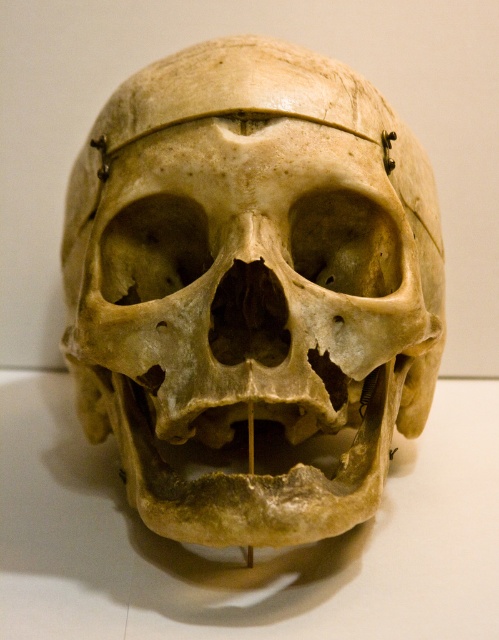
Question: Is bone-like skull at center to the right of yellowish bone at center from the viewer's perspective?

Choices:
 (A) no
 (B) yes

Answer: (B)

Question: Is bone-like skull at center bigger than yellowish bone at center?

Choices:
 (A) yes
 (B) no

Answer: (B)

Question: Among these points, which one is nearest to the camera?

Choices:
 (A) (24, 531)
 (B) (180, 314)

Answer: (B)

Question: Which point is closer to the camera?

Choices:
 (A) (268, 570)
 (B) (387, 291)

Answer: (B)

Question: Is bone-like skull at center thinner than yellowish bone at center?

Choices:
 (A) no
 (B) yes

Answer: (B)

Question: Which object is farther from the camera taking this photo?

Choices:
 (A) bone-like skull at center
 (B) yellowish bone at center

Answer: (B)